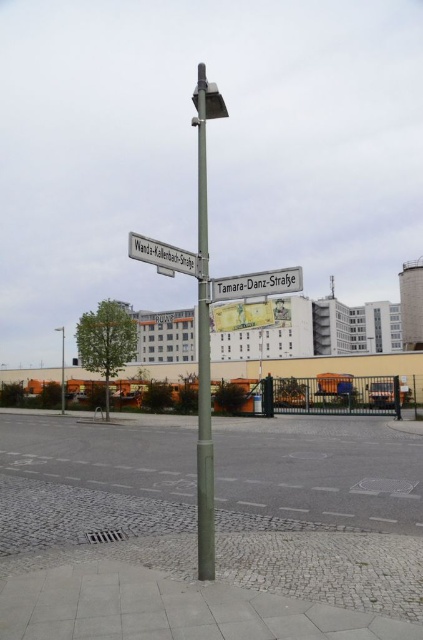
Question: Does gray cobblestone parking lot at lower center come behind metallic silver street sign at center?

Choices:
 (A) yes
 (B) no

Answer: (A)

Question: Among these objects, which one is farthest from the camera?

Choices:
 (A) metallic silver street sign at center
 (B) white plastic street sign at upper left

Answer: (A)

Question: Estimate the real-world distances between objects in this image. Which object is farther from the gray cobblestone parking lot at lower center?

Choices:
 (A) white plastic street sign at upper left
 (B) matte green pole at center

Answer: (B)

Question: Is metallic silver street sign at center positioned before matte green pole at center?

Choices:
 (A) no
 (B) yes

Answer: (B)

Question: Estimate the real-world distances between objects in this image. Which object is closer to the metallic silver street sign at center?

Choices:
 (A) gray cobblestone parking lot at lower center
 (B) matte green pole at center
 (C) white plastic street sign at upper left

Answer: (C)

Question: Can you confirm if metallic silver street sign at center is smaller than matte green pole at center?

Choices:
 (A) yes
 (B) no

Answer: (A)